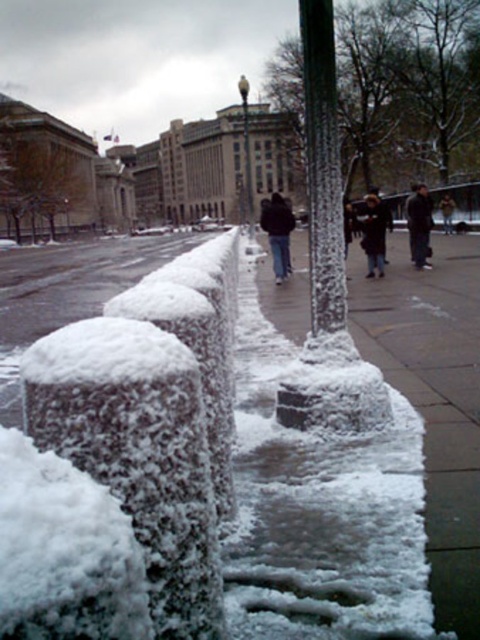
Question: Considering the relative positions of dark blue jacket at center and dark gray fabric coat at center in the image provided, where is dark blue jacket at center located with respect to dark gray fabric coat at center?

Choices:
 (A) right
 (B) left

Answer: (B)

Question: Can you confirm if white frosty sidewalk at center is positioned above dark blue jeans at center?

Choices:
 (A) no
 (B) yes

Answer: (A)

Question: Which of the following is the farthest from the observer?

Choices:
 (A) dark blue jacket at center
 (B) dark gray jacket at center
 (C) white frosted pole at center

Answer: (B)

Question: Which point is closer to the camera taking this photo?

Choices:
 (A) (427, 208)
 (B) (305, 1)
 (C) (444, 220)
 (D) (464, 563)

Answer: (D)

Question: Is white frosty sidewalk at center below dark gray fabric coat at center?

Choices:
 (A) no
 (B) yes

Answer: (B)

Question: Which of the following is the farthest from the observer?

Choices:
 (A) dark gray fabric coat at center
 (B) white frosty sidewalk at center
 (C) white frosted pole at center
 (D) dark gray jacket at center

Answer: (D)